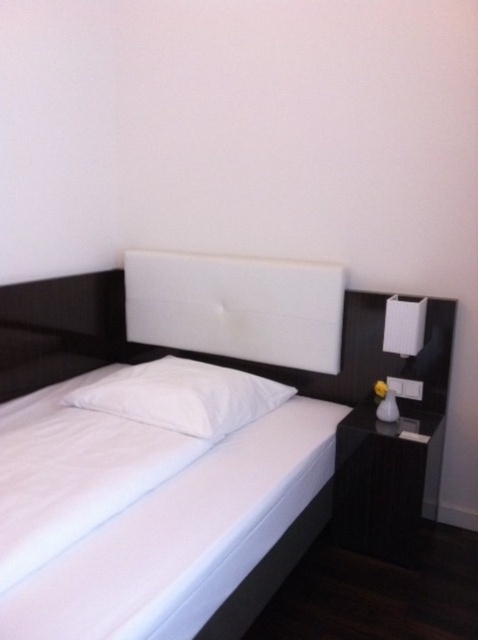
Question: Does white leather bed at center have a greater width compared to white smooth bedsheet at center?

Choices:
 (A) yes
 (B) no

Answer: (A)

Question: Does white smooth bedsheet at center have a smaller size compared to white glossy lamp at right?

Choices:
 (A) yes
 (B) no

Answer: (B)

Question: Which object is positioned closest to the white soft pillow at center?

Choices:
 (A) white leather headboard at center
 (B) white glossy lamp at right
 (C) white leather bed at center

Answer: (C)

Question: Which of the following is the closest to the observer?

Choices:
 (A) white leather headboard at center
 (B) white leather bed at center
 (C) white glossy lamp at right

Answer: (B)

Question: Among these points, which one is farthest from the camera?

Choices:
 (A) (391, 337)
 (B) (228, 426)
 (C) (300, 348)
 (D) (217, 298)

Answer: (D)

Question: Is white smooth bedsheet at center to the left of white soft pillow at center from the viewer's perspective?

Choices:
 (A) no
 (B) yes

Answer: (B)